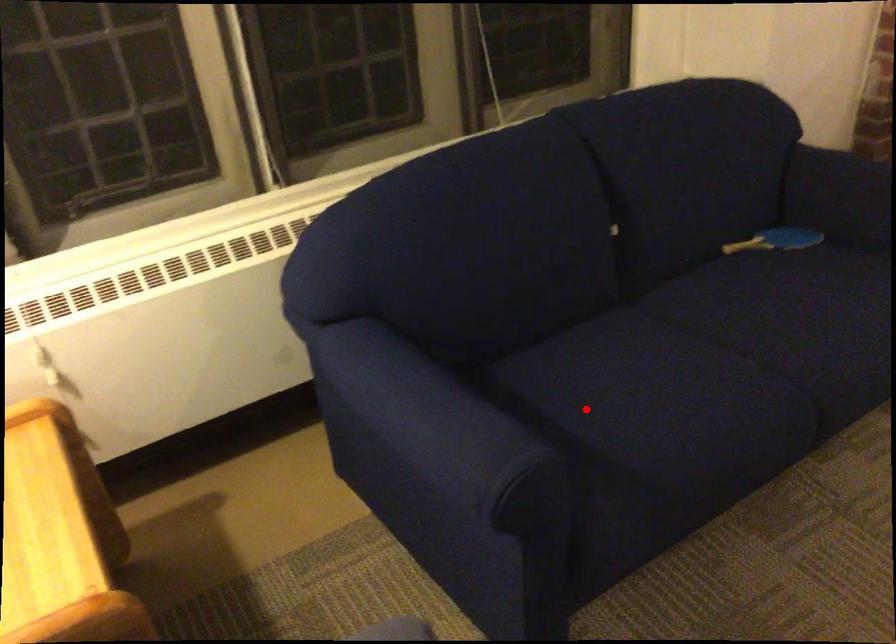
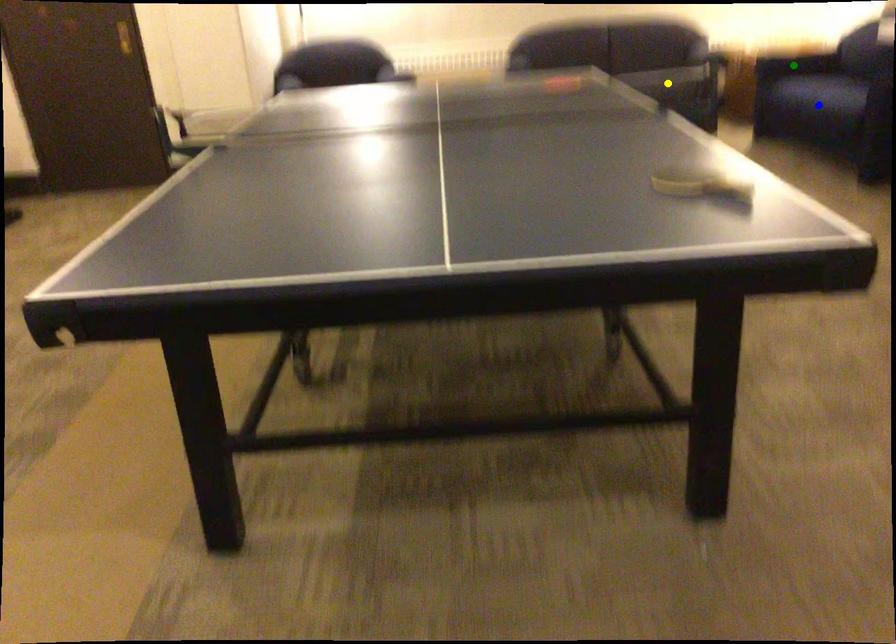
Question: I am providing you with two images of the same scene from different viewpoints. A red point is marked on the first image. You are given multiple points on the second image. Which spot in image 2 lines up with the point in image 1?

Choices:
 (A) blue point
 (B) green point
 (C) yellow point

Answer: (B)